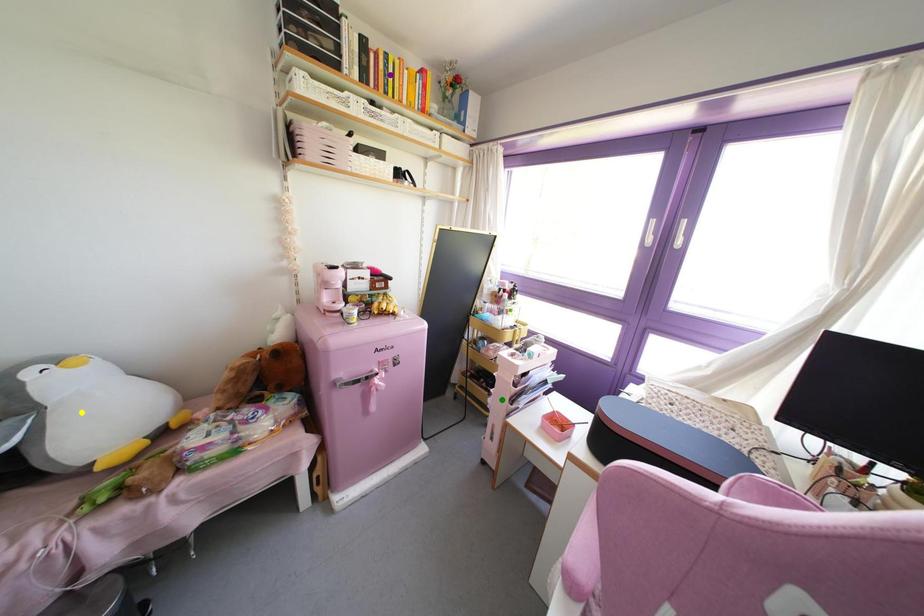
Order these from farthest to nearest:
green point
yellow point
purple point

green point
purple point
yellow point